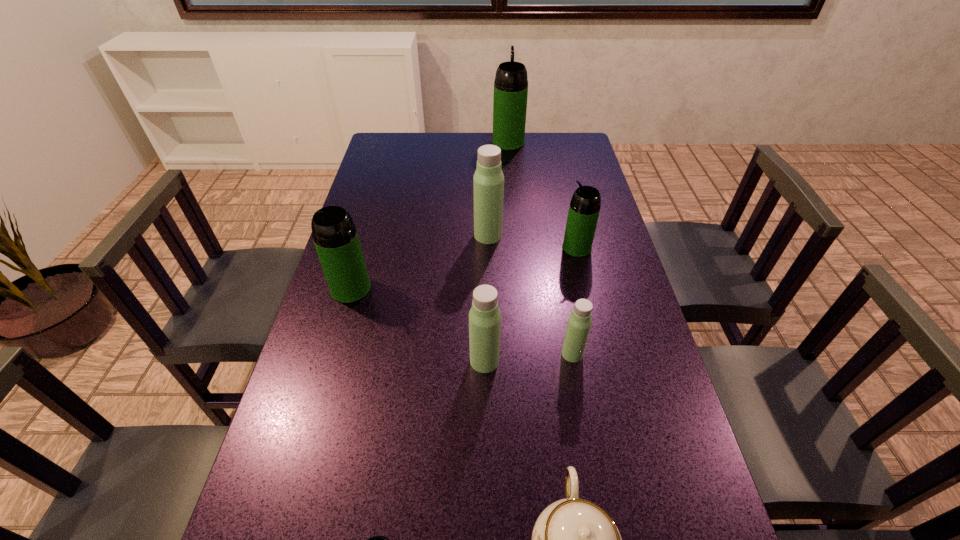
Where is `the farthest green thermos bottle`? the farthest green thermos bottle is located at coordinates (511, 82).

Find the location of a particular element. This screenshot has height=540, width=960. the tallest thermos bottle is located at coordinates (511, 82).

Locate an element on the screen. This screenshot has width=960, height=540. the third smallest green thermos bottle is located at coordinates (335, 236).

Where is `the fourth farthest object`? The height and width of the screenshot is (540, 960). the fourth farthest object is located at coordinates (335, 236).

Where is `the biggest light thermos bottle`? The height and width of the screenshot is (540, 960). the biggest light thermos bottle is located at coordinates (488, 182).

Identify the location of the rightmost green thermos bottle. The image size is (960, 540). (584, 209).

This screenshot has height=540, width=960. What are the coordinates of `the third biggest green thermos bottle` in the screenshot? It's located at (584, 209).

This screenshot has width=960, height=540. I want to click on the second biggest light thermos bottle, so click(x=484, y=316).

Locate an element on the screen. the rightmost light thermos bottle is located at coordinates (579, 323).

Where is `the sixth thermos bottle from left to right`? the sixth thermos bottle from left to right is located at coordinates (579, 323).